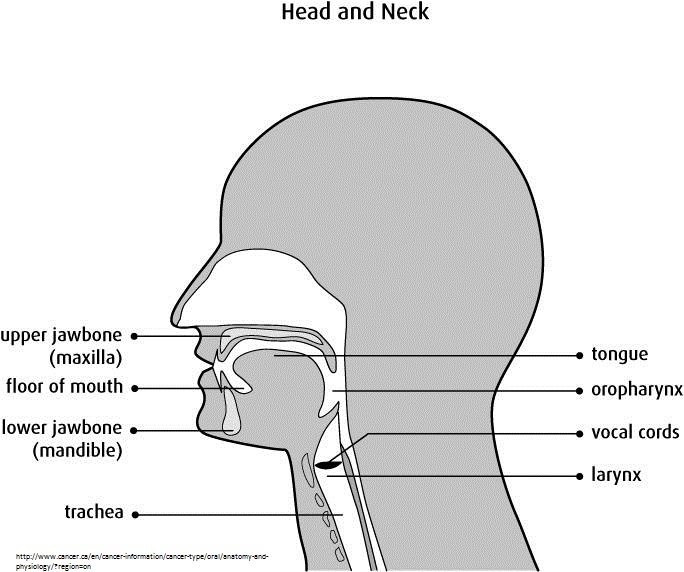
Image resolution: width=684 pixels, height=572 pixels. In order to click on picture in this screenshot , I will do click(x=418, y=319).